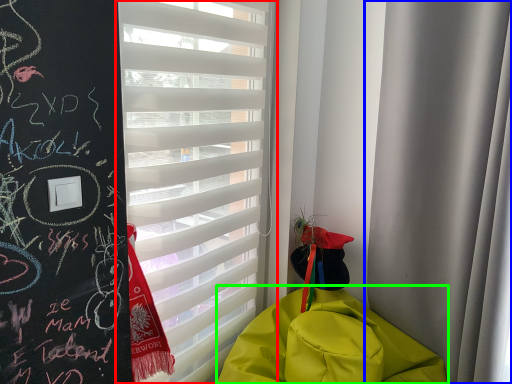
Question: Which is farther away from window blind (highlighted by a red box)? curtain (highlighted by a blue box) or blanket (highlighted by a green box)?

Choices:
 (A) curtain
 (B) blanket

Answer: (A)